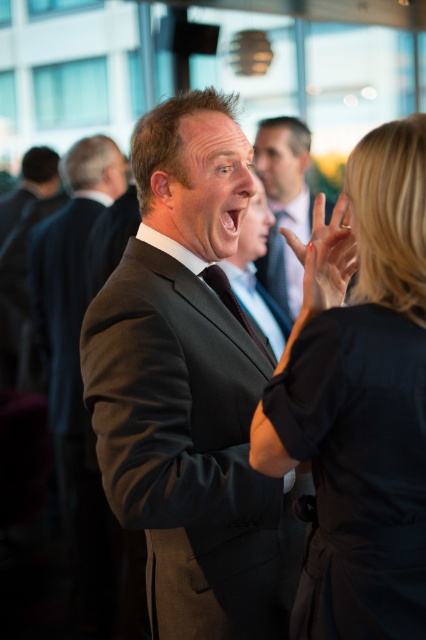
Can you confirm if dark gray suit at center is bigger than matte black suit at center?

Actually, dark gray suit at center might be smaller than matte black suit at center.

Measure the distance between dark gray suit at center and camera.

The distance of dark gray suit at center from camera is 4.63 feet.

Between point (198, 528) and point (287, 307), which one is positioned behind?

Point (287, 307)

In order to click on dark gray suit at center in this screenshot , I will do `click(187, 448)`.

Can you confirm if matte black suit at center is positioned to the left of smooth skin hand at center?

Incorrect, matte black suit at center is not on the left side of smooth skin hand at center.

Is the position of matte black suit at center less distant than that of smooth skin hand at center?

No, it is not.

This screenshot has width=426, height=640. In order to click on matte black suit at center in this screenshot , I will do `click(284, 204)`.

Identify the location of matte black suit at center. This screenshot has width=426, height=640. (284, 204).

Which of these two, black matte dress at center or matte black suit at center, stands shorter?

black matte dress at center is shorter.

The width and height of the screenshot is (426, 640). I want to click on black matte dress at center, so click(359, 397).